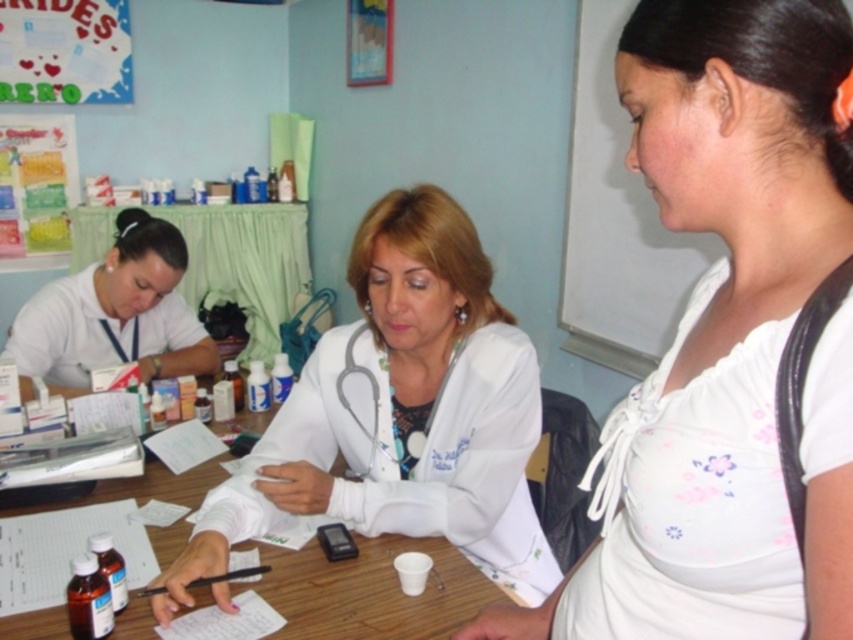
Question: Which object appears farthest from the camera in this image?

Choices:
 (A) white cotton shirt at center
 (B) wooden table at center

Answer: (B)

Question: Is wooden table at center further to camera compared to white paper at left?

Choices:
 (A) no
 (B) yes

Answer: (A)

Question: Is white cotton shirt at center positioned behind white matte lab coat at center?

Choices:
 (A) no
 (B) yes

Answer: (A)

Question: Which point is closer to the camera taking this photo?

Choices:
 (A) (451, 573)
 (B) (346, 449)
 (C) (167, 266)

Answer: (A)

Question: Does white glossy stethoscope at upper left have a smaller size compared to white paper at left?

Choices:
 (A) no
 (B) yes

Answer: (B)

Question: Estimate the real-world distances between objects in this image. Which object is farther from the white paper at left?

Choices:
 (A) wooden table at center
 (B) white fabric stethoscope at center

Answer: (B)